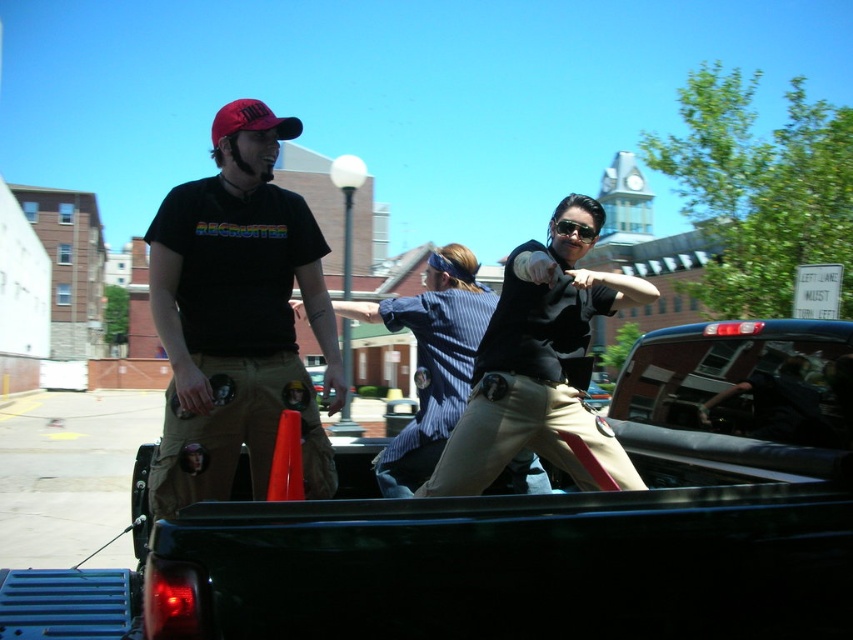
Does matte black t-shirt at left lie behind khaki pants at center?

Yes, it is.

From the picture: Can you confirm if matte black t-shirt at left is shorter than khaki pants at center?

Incorrect, matte black t-shirt at left's height does not fall short of khaki pants at center's.

Which is in front, point (193, 305) or point (512, 365)?

Point (512, 365) is in front.

Identify the location of matte black t-shirt at left. The width and height of the screenshot is (853, 640). (236, 317).